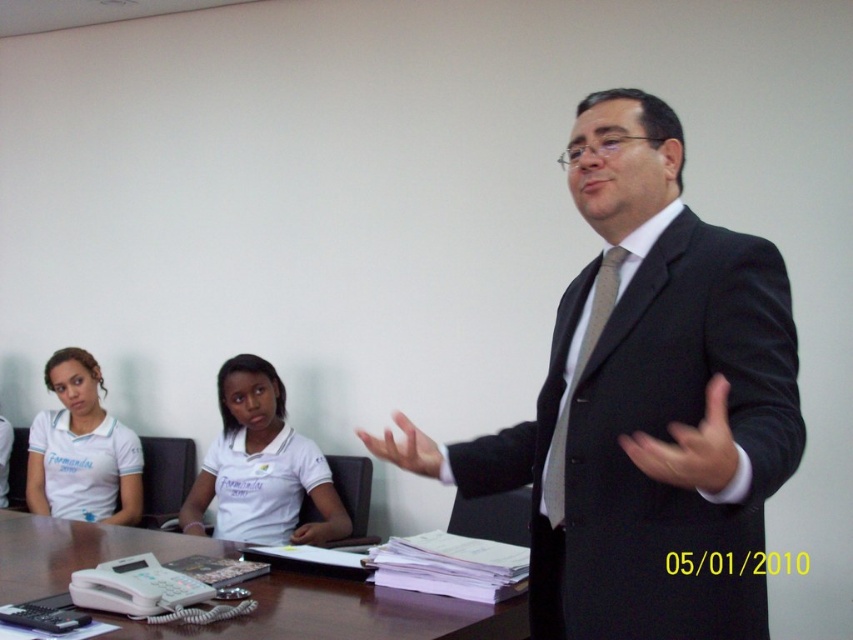
Is black suit at center shorter than brown wooden table at center?

Incorrect, black suit at center's height does not fall short of brown wooden table at center's.

Is point (549, 401) positioned in front of point (10, 516)?

Yes, point (549, 401) is closer to viewer.

Identify the location of black suit at center. This screenshot has width=853, height=640. (645, 404).

Between black suit at center and white cotton shirt at center, which one is positioned lower?

white cotton shirt at center is lower down.

Consider the image. Who is taller, black suit at center or white cotton shirt at center?

With more height is black suit at center.

Locate an element on the screen. The width and height of the screenshot is (853, 640). black suit at center is located at coordinates (645, 404).

Between white cotton shirt at center and white fabric shirt at left, which one has more height?

With more height is white fabric shirt at left.

Between white cotton shirt at center and white fabric shirt at left, which one is positioned lower?

Positioned lower is white cotton shirt at center.

Measure the distance between point (247, 426) and camera.

Point (247, 426) is 10.27 feet from camera.

You are a GUI agent. You are given a task and a screenshot of the screen. Output one action in this format:
    pyautogui.click(x=<x>, y=<y>)
    Task: Click on the white cotton shirt at center
    
    Given the screenshot: What is the action you would take?
    pyautogui.click(x=260, y=467)